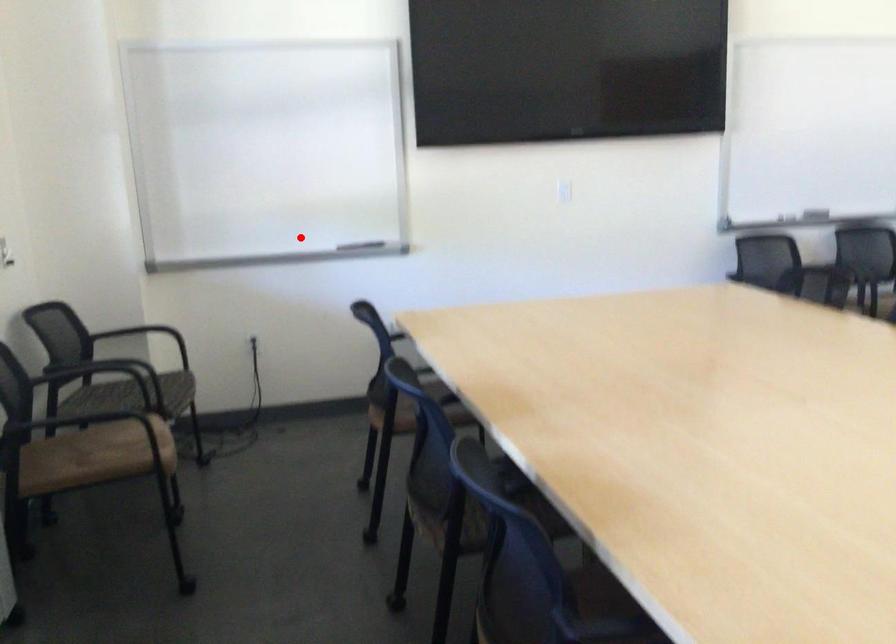
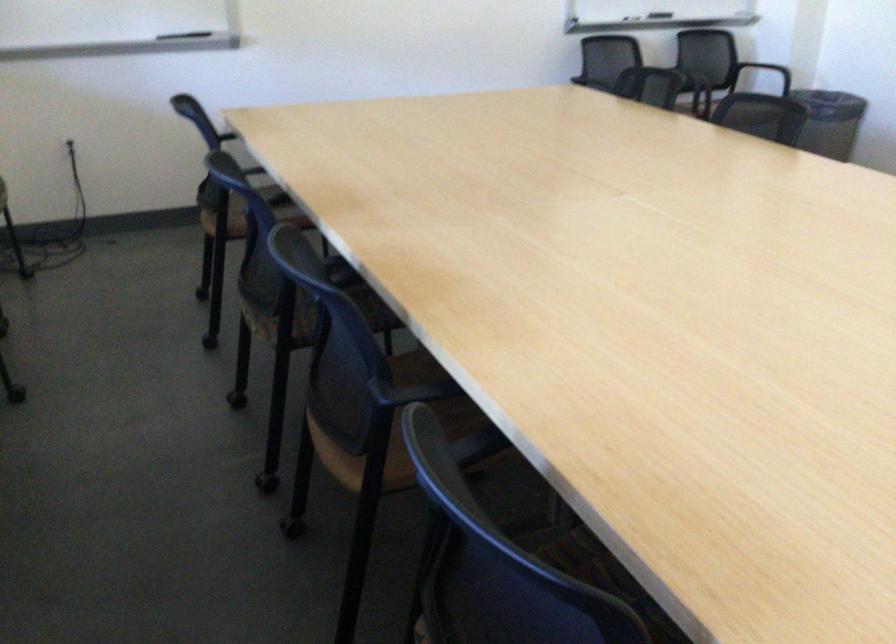
Question: I am providing you with two images of the same scene from different viewpoints. Given a red point in image1, look at the same physical point in image2. Is it:

Choices:
 (A) Closer to the viewpoint
 (B) Farther from the viewpoint

Answer: (A)